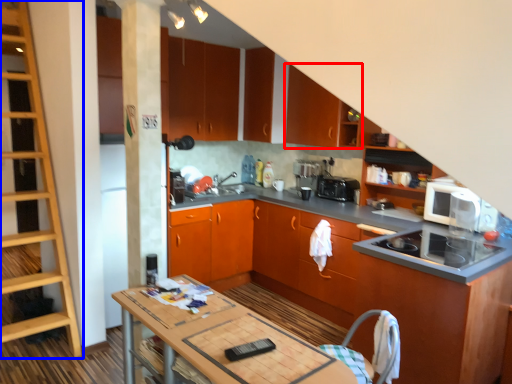
Question: Which of the following is the closest to the observer, cabinetry (highlighted by a red box) or shelf (highlighted by a blue box)?

Choices:
 (A) cabinetry
 (B) shelf

Answer: (B)